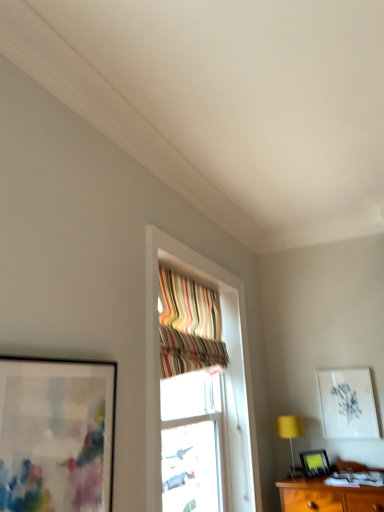
Question: From the image's perspective, relative to matte black picture frame at left, acting as the third picture frame starting from the bottom, is white paper at upper right, marked as the first picture frame in a right-to-left arrangement, above or below?

Choices:
 (A) below
 (B) above

Answer: (A)

Question: Is white paper at upper right, which is counted as the 2th picture frame, starting from the bottom, wider or thinner than matte black picture frame at left, marked as the first picture frame in a top-to-bottom arrangement?

Choices:
 (A) wide
 (B) thin

Answer: (B)

Question: Which object is positioned farthest from the matte black picture frame at left, marked as the first picture frame in a top-to-bottom arrangement?

Choices:
 (A) matte black picture frame at lower right, the 2th picture frame positioned from the right
 (B) white paper at upper right, placed as the 3th picture frame when sorted from left to right
 (C) striped fabric curtain at upper center
 (D) yellow fabric table lamp at lower right

Answer: (B)

Question: Based on their relative distances, which object is farther from the striped fabric curtain at upper center?

Choices:
 (A) matte black picture frame at lower right, the second picture frame from the left
 (B) matte black picture frame at left, arranged as the third picture frame when viewed from the back
 (C) yellow fabric table lamp at lower right
 (D) white paper at upper right, marked as the first picture frame in a right-to-left arrangement

Answer: (A)